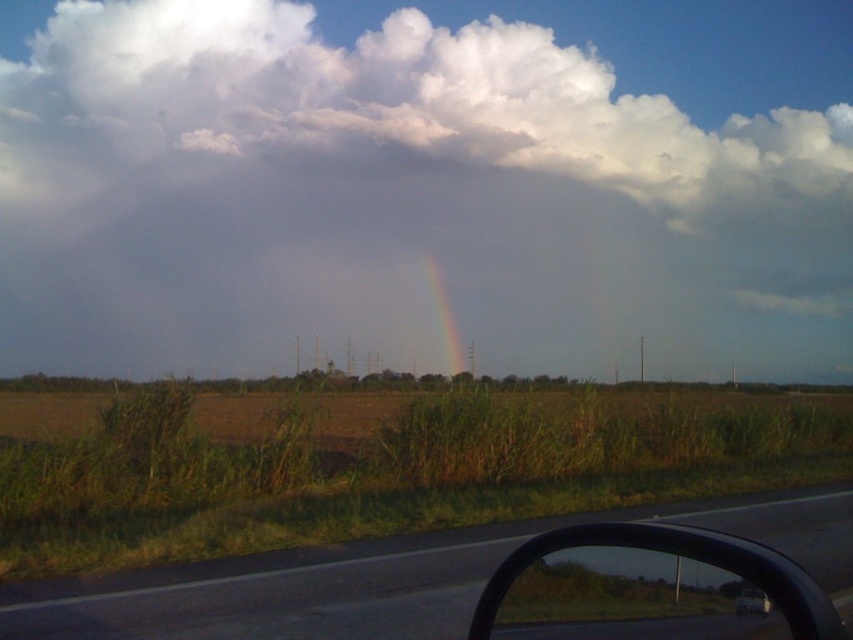
Question: Is white fluffy cloud at upper center to the left of asphalt road at lower center from the viewer's perspective?

Choices:
 (A) no
 (B) yes

Answer: (B)

Question: Does white fluffy cloud at upper center have a larger size compared to white glossy car at lower right?

Choices:
 (A) yes
 (B) no

Answer: (A)

Question: Which object is the closest to the white glossy car at lower right?

Choices:
 (A) transparent glass car window at lower right
 (B) rainbow at center

Answer: (A)

Question: Is white fluffy cloud at upper center to the right of white glossy car at lower right from the viewer's perspective?

Choices:
 (A) no
 (B) yes

Answer: (A)

Question: Which object is the farthest from the asphalt road at lower center?

Choices:
 (A) white fluffy cloud at upper center
 (B) transparent glass car window at lower right
 (C) white glossy car at lower right

Answer: (A)

Question: Among these objects, which one is farthest from the camera?

Choices:
 (A) rainbow at center
 (B) white fluffy cloud at upper center
 (C) white glossy car at lower right

Answer: (A)